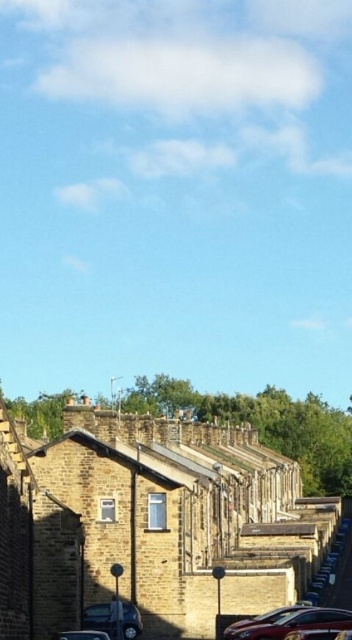
Can you confirm if metallic silver car at lower center is taller than shiny metallic car at lower center?

In fact, metallic silver car at lower center may be shorter than shiny metallic car at lower center.

At what (x,y) coordinates should I click in order to perform the action: click on metallic silver car at lower center. Please return your answer as a coordinate pair (x, y). Looking at the image, I should click on (291, 621).

What do you see at coordinates (291, 621) in the screenshot? I see `metallic silver car at lower center` at bounding box center [291, 621].

The width and height of the screenshot is (352, 640). Identify the location of metallic silver car at lower center. (291, 621).

Does shiny black car at lower left come in front of metallic pole at center?

No, shiny black car at lower left is behind metallic pole at center.

What do you see at coordinates (97, 616) in the screenshot? This screenshot has height=640, width=352. I see `shiny black car at lower left` at bounding box center [97, 616].

Locate an element on the screen. The height and width of the screenshot is (640, 352). shiny black car at lower left is located at coordinates (97, 616).

Does shiny black car at lower left have a lesser width compared to shiny metallic car at lower center?

Yes, shiny black car at lower left is thinner than shiny metallic car at lower center.

Between shiny black car at lower left and shiny metallic car at lower center, which one is positioned lower?

shiny black car at lower left is lower down.

Which is in front, point (105, 605) or point (82, 636)?

Point (82, 636) is in front.

Find the location of `shiny black car at lower left`. shiny black car at lower left is located at coordinates (97, 616).